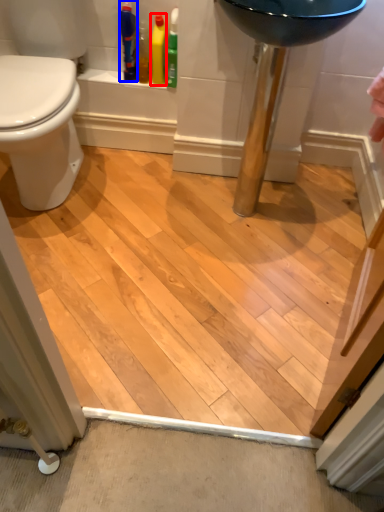
Question: Which point is further to the camera, cleaning product (highlighted by a red box) or toiletry (highlighted by a blue box)?

Choices:
 (A) cleaning product
 (B) toiletry

Answer: (A)